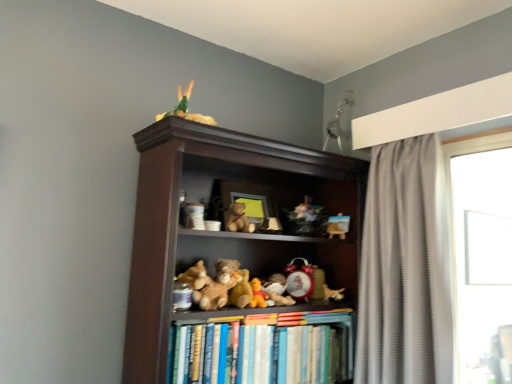
Question: Which direction should I rotate to look at matte white figurine at center, the sixth toy viewed from the right?

Choices:
 (A) left
 (B) right

Answer: (B)

Question: Could you tell me if soft plush dog at center, which ranks as the ninth toy in left-to-right order, is facing wooden easel at upper center, which appears as the 1th toy when viewed from the right?

Choices:
 (A) yes
 (B) no

Answer: (B)

Question: Does soft plush dog at center, which ranks as the ninth toy in left-to-right order, have a lesser width compared to wooden easel at upper center, which appears as the tenth toy when viewed from the left?

Choices:
 (A) no
 (B) yes

Answer: (A)

Question: Considering the relative sizes of soft plush dog at center, arranged as the second toy when viewed from the right, and wooden easel at upper center, which appears as the tenth toy when viewed from the left, in the image provided, is soft plush dog at center, arranged as the second toy when viewed from the right, shorter than wooden easel at upper center, which appears as the tenth toy when viewed from the left,?

Choices:
 (A) yes
 (B) no

Answer: (A)

Question: Is soft plush dog at center, which ranks as the ninth toy in left-to-right order, turned away from wooden easel at upper center, which appears as the 1th toy when viewed from the right?

Choices:
 (A) no
 (B) yes

Answer: (A)

Question: From the image's perspective, would you say soft plush dog at center, which ranks as the ninth toy in left-to-right order, is shown under wooden easel at upper center, which appears as the tenth toy when viewed from the left?

Choices:
 (A) yes
 (B) no

Answer: (A)

Question: Can you confirm if soft plush dog at center, arranged as the second toy when viewed from the right, is taller than wooden easel at upper center, which appears as the 1th toy when viewed from the right?

Choices:
 (A) yes
 (B) no

Answer: (B)

Question: Is matte white figurine at center, the sixth toy viewed from the right, oriented towards brown plush bear at center, which is the fourth toy in left-to-right order?

Choices:
 (A) yes
 (B) no

Answer: (B)

Question: Can you confirm if matte white figurine at center, which is the 5th toy from left to right, is smaller than brown plush bear at center, which is the fourth toy in left-to-right order?

Choices:
 (A) no
 (B) yes

Answer: (B)

Question: Is matte white figurine at center, the sixth toy viewed from the right, placed right next to brown plush bear at center, which is the fourth toy in left-to-right order?

Choices:
 (A) no
 (B) yes

Answer: (A)

Question: Is matte white figurine at center, the sixth toy viewed from the right, outside of brown plush bear at center, which is the fourth toy in left-to-right order?

Choices:
 (A) yes
 (B) no

Answer: (A)

Question: Is matte white figurine at center, which is the 5th toy from left to right, at the left side of brown plush bear at center, which ranks as the seventh toy in right-to-left order?

Choices:
 (A) yes
 (B) no

Answer: (B)

Question: Does matte white figurine at center, which is the 5th toy from left to right, have a greater height compared to brown plush bear at center, which is the fourth toy in left-to-right order?

Choices:
 (A) yes
 (B) no

Answer: (B)

Question: Does matte white ceramic cup at center, placed as the tenth toy when sorted from right to left, turn towards transparent glass window at right?

Choices:
 (A) no
 (B) yes

Answer: (A)